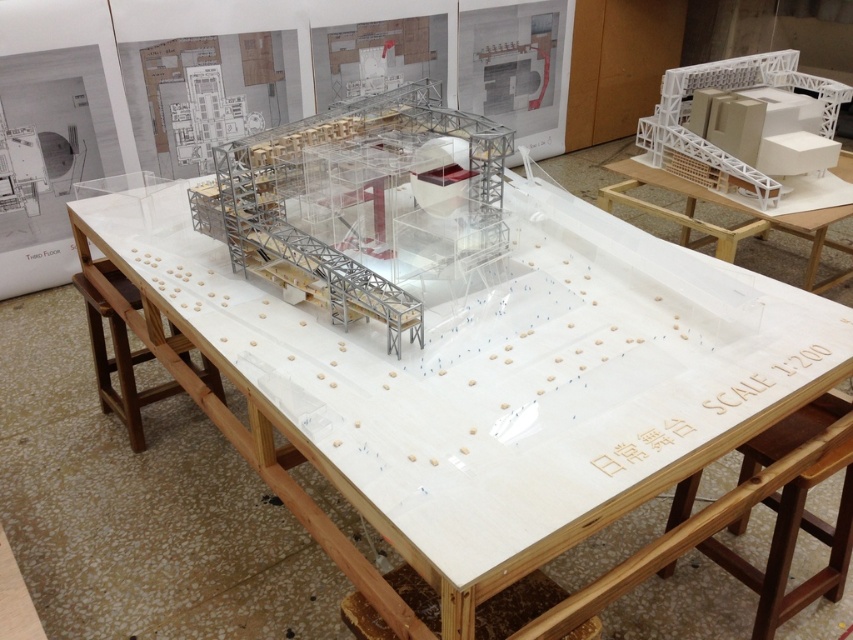
Question: From the image, what is the correct spatial relationship of brown wood stool at lower right in relation to white matte table at upper right?

Choices:
 (A) right
 (B) left

Answer: (B)

Question: Based on their relative distances, which object is farther from the white matte table at upper right?

Choices:
 (A) white wood table at center
 (B) brown wood stool at lower right

Answer: (A)

Question: Does brown wood stool at lower right appear under white matte table at upper right?

Choices:
 (A) yes
 (B) no

Answer: (A)

Question: Is brown wood stool at lower right wider than white matte table at upper right?

Choices:
 (A) yes
 (B) no

Answer: (B)

Question: Estimate the real-world distances between objects in this image. Which object is closer to the white wood table at center?

Choices:
 (A) brown wood stool at lower right
 (B) white matte table at upper right

Answer: (A)

Question: Which object appears closest to the camera in this image?

Choices:
 (A) brown wood stool at lower right
 (B) white matte table at upper right

Answer: (A)